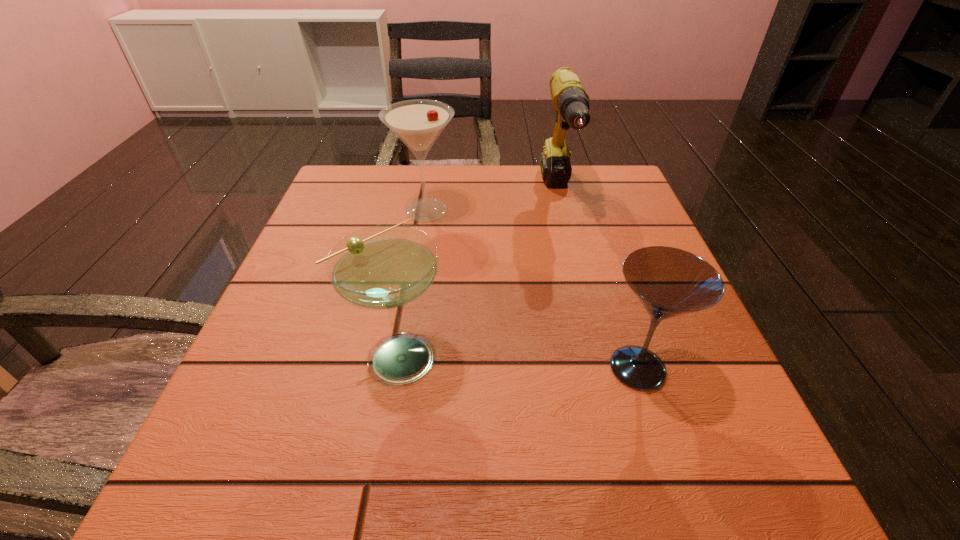
Find the location of `martini at the right edge`. martini at the right edge is located at coordinates (669, 282).

Locate an element on the screen. The height and width of the screenshot is (540, 960). object present at the far right corner is located at coordinates (571, 101).

At what (x,y) coordinates should I click in order to perform the action: click on free space at the far edge. Please return your answer as a coordinate pair (x, y). Looking at the image, I should click on (428, 176).

Find the location of `vacant area at the near edge of the desktop`. vacant area at the near edge of the desktop is located at coordinates (636, 481).

In the image, there is a desktop. At what (x,y) coordinates should I click in order to perform the action: click on vacant region at the left edge. Please return your answer as a coordinate pair (x, y). Looking at the image, I should click on (299, 264).

At what (x,y) coordinates should I click in order to perform the action: click on vacant region at the right edge of the desktop. Please return your answer as a coordinate pair (x, y). The height and width of the screenshot is (540, 960). Looking at the image, I should click on (678, 364).

At what (x,y) coordinates should I click in order to perform the action: click on free point at the far left corner. Please return your answer as a coordinate pair (x, y). The width and height of the screenshot is (960, 540). Looking at the image, I should click on (354, 205).

Image resolution: width=960 pixels, height=540 pixels. Find the location of `free space at the near right corner`. free space at the near right corner is located at coordinates click(664, 514).

Locate an element on the screen. This screenshot has height=540, width=960. vacant area that lies between the rightmost martini and the farthest martini is located at coordinates (532, 289).

Where is `free point between the drill and the shortest object`? The width and height of the screenshot is (960, 540). free point between the drill and the shortest object is located at coordinates (598, 281).